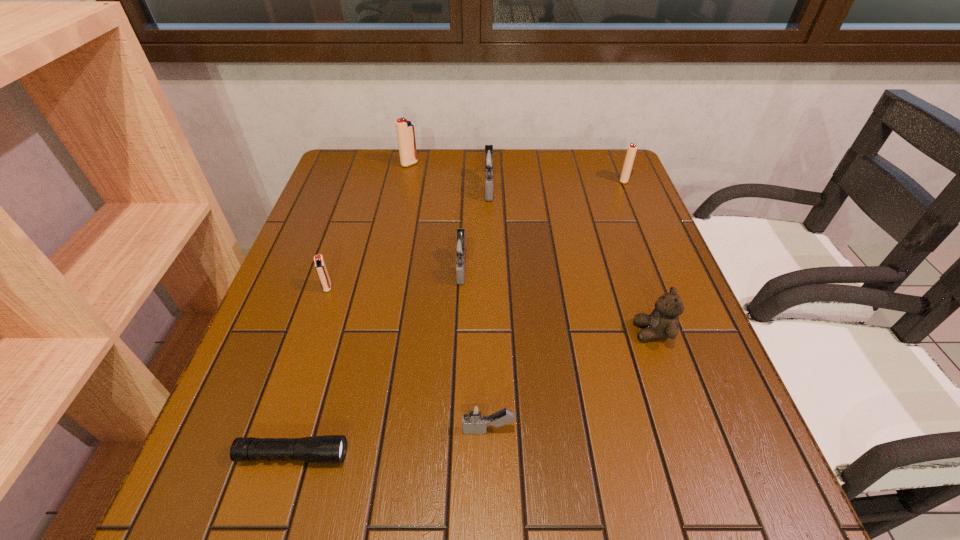
Locate which gray igniter ranks in proximity to the flashlight. Please provide its 2D coordinates. Your answer should be formatted as a tuple, i.e. [(x, y)], where the tuple contains the x and y coordinates of a point satisfying the conditions above.

[(475, 417)]

Select which gray igniter appears as the second closest to the sixth farthest object. Please provide its 2D coordinates. Your answer should be formatted as a tuple, i.e. [(x, y)], where the tuple contains the x and y coordinates of a point satisfying the conditions above.

[(460, 247)]

This screenshot has height=540, width=960. I want to click on vacant space that satisfies the following two spatial constraints: 1. on the front side of the second red igniter from right to left; 2. on the right side of the biggest gray igniter, so click(404, 188).

This screenshot has width=960, height=540. Find the location of `free space that satisfies the following two spatial constraints: 1. on the front side of the leftmost igniter; 2. on the left side of the smallest gray igniter`. free space that satisfies the following two spatial constraints: 1. on the front side of the leftmost igniter; 2. on the left side of the smallest gray igniter is located at coordinates (279, 430).

Find the location of a particular element. This screenshot has width=960, height=540. free spot that satisfies the following two spatial constraints: 1. on the face of the brown teddy bear; 2. on the front side of the nearest igniter is located at coordinates (686, 430).